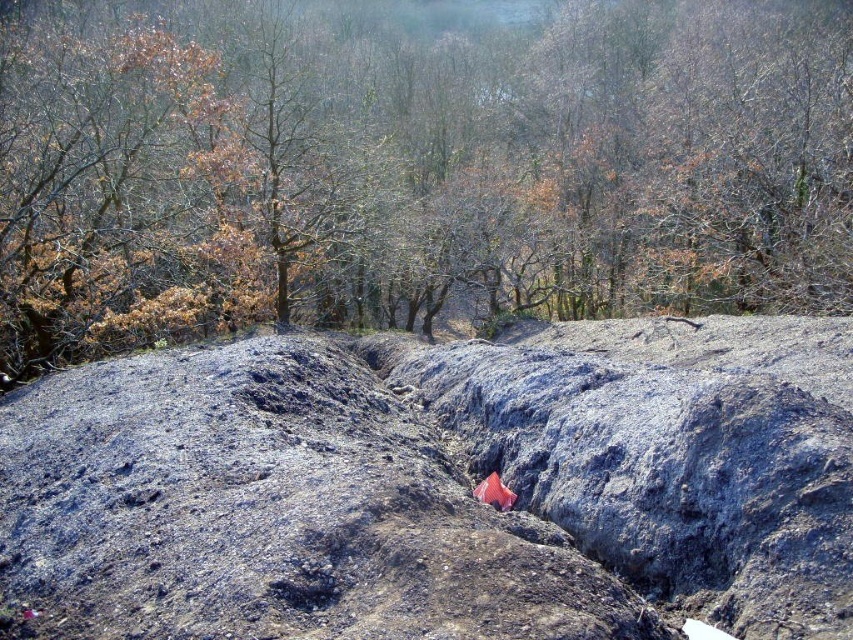
Question: Among these objects, which one is farthest from the camera?

Choices:
 (A) dull gray rock at center
 (B) brown leafy tree at upper center

Answer: (B)

Question: Which of the following is the closest to the observer?

Choices:
 (A) brown leafy tree at upper center
 (B) dull gray rock at center

Answer: (B)

Question: Does brown leafy tree at upper center have a smaller size compared to dull gray rock at center?

Choices:
 (A) no
 (B) yes

Answer: (A)

Question: Can you confirm if brown leafy tree at upper center is smaller than dull gray rock at center?

Choices:
 (A) no
 (B) yes

Answer: (A)

Question: Does brown leafy tree at upper center appear under dull gray rock at center?

Choices:
 (A) no
 (B) yes

Answer: (A)

Question: Among these objects, which one is farthest from the camera?

Choices:
 (A) brown leafy tree at upper center
 (B) dull gray rock at center

Answer: (A)